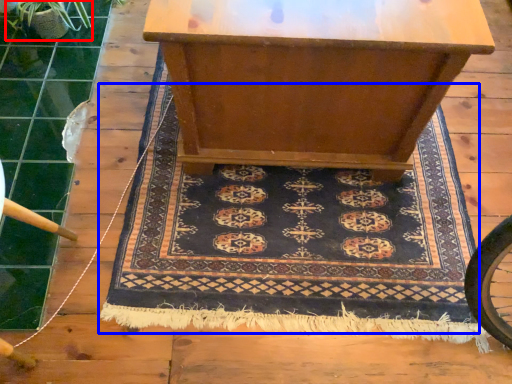
Question: Which object appears closest to the camera in this image, plant (highlighted by a red box) or mat (highlighted by a blue box)?

Choices:
 (A) plant
 (B) mat

Answer: (B)